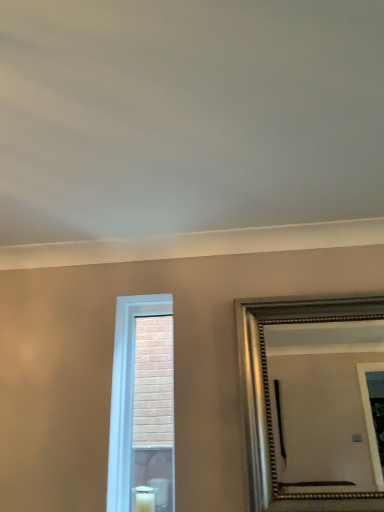
The width and height of the screenshot is (384, 512). Find the location of `white glass window at center`. white glass window at center is located at coordinates (142, 403).

In the scene shown: Can silver metallic mirror at right be found inside white glass window at center?

No.

Is point (164, 506) behind point (295, 327)?

Yes, point (164, 506) is behind point (295, 327).

From the image's perspective, is white glass window at center under silver metallic mirror at right?

Yes, from the image's perspective, white glass window at center is beneath silver metallic mirror at right.

Which object is positioned more to the right, white glass window at center or silver metallic mirror at right?

silver metallic mirror at right.

Where is `candle that is on the right side of white glass window at center`? This screenshot has height=512, width=384. candle that is on the right side of white glass window at center is located at coordinates [x=144, y=499].

Can you confirm if white glass window at center is thinner than white wax candle at lower center?

Indeed, white glass window at center has a lesser width compared to white wax candle at lower center.

Does white glass window at center have a smaller size compared to white wax candle at lower center?

No.

Is white glass window at center far away from white wax candle at lower center?

No, there isn't a large distance between white glass window at center and white wax candle at lower center.

Is silver metallic mirror at right far from white wax candle at lower center?

Yes, silver metallic mirror at right is far from white wax candle at lower center.

How distant is silver metallic mirror at right from white wax candle at lower center?

silver metallic mirror at right and white wax candle at lower center are 1.70 meters apart.

Which of these two, silver metallic mirror at right or white wax candle at lower center, stands shorter?

white wax candle at lower center is shorter.

Is silver metallic mirror at right completely or partially outside of white wax candle at lower center?

Yes, silver metallic mirror at right is outside of white wax candle at lower center.

Is silver metallic mirror at right at the back of white wax candle at lower center?

white wax candle at lower center does not have its back to silver metallic mirror at right.

Between white wax candle at lower center and silver metallic mirror at right, which one has larger size?

With larger size is silver metallic mirror at right.

Find the location of a particular element. mirror positioned vertically above the white wax candle at lower center (from a real-world perspective) is located at coordinates (x=325, y=405).

Would you say white wax candle at lower center is to the left or to the right of silver metallic mirror at right in the picture?

white wax candle at lower center is to the left of silver metallic mirror at right.

Can you confirm if white wax candle at lower center is bigger than white glass window at center?

Actually, white wax candle at lower center might be smaller than white glass window at center.

From the image's perspective, which is below, white wax candle at lower center or white glass window at center?

From the image's view, white wax candle at lower center is below.

From a real-world perspective, relative to white glass window at center, is white wax candle at lower center vertically above or below?

white wax candle at lower center is situated lower than white glass window at center in the real world.

Is white wax candle at lower center facing towards white glass window at center?

No, white wax candle at lower center is not oriented towards white glass window at center.

Based on the photo, is silver metallic mirror at right behind white glass window at center?

No, it is not.

The width and height of the screenshot is (384, 512). Find the location of `mirror beneath the white glass window at center (from a real-world perspective)`. mirror beneath the white glass window at center (from a real-world perspective) is located at coordinates (325, 405).

Is point (285, 459) closer to camera compared to point (165, 463)?

Yes, it is.

You are a GUI agent. You are given a task and a screenshot of the screen. Output one action in this format:
    pyautogui.click(x=<x>, y=<y>)
    Task: Click on the window that is below the silver metallic mirror at right (from the image's perspective)
    
    Given the screenshot: What is the action you would take?
    pyautogui.click(x=142, y=403)

Where is `candle to the right of white glass window at center`? This screenshot has width=384, height=512. candle to the right of white glass window at center is located at coordinates (144, 499).

Looking at the image, which one is located further to white wax candle at lower center, silver metallic mirror at right or white glass window at center?

Based on the image, silver metallic mirror at right appears to be further to white wax candle at lower center.

Estimate the real-world distances between objects in this image. Which object is further from silver metallic mirror at right, white wax candle at lower center or white glass window at center?

Based on the image, white wax candle at lower center appears to be further to silver metallic mirror at right.

Estimate the real-world distances between objects in this image. Which object is closer to white wax candle at lower center, white glass window at center or silver metallic mirror at right?

white glass window at center is positioned closer to the anchor white wax candle at lower center.

Considering their positions, is white wax candle at lower center positioned closer to white glass window at center than silver metallic mirror at right?

white wax candle at lower center lies closer to white glass window at center than the other object.

Considering their positions, is white glass window at center positioned closer to silver metallic mirror at right than white wax candle at lower center?

white glass window at center.

From the image, which object appears to be nearer to white glass window at center, silver metallic mirror at right or white wax candle at lower center?

Based on the image, white wax candle at lower center appears to be nearer to white glass window at center.

You are a GUI agent. You are given a task and a screenshot of the screen. Output one action in this format:
    pyautogui.click(x=<x>, y=<y>)
    Task: Click on the candle situated between white glass window at center and silver metallic mirror at right from left to right
    Image resolution: width=384 pixels, height=512 pixels.
    Given the screenshot: What is the action you would take?
    pyautogui.click(x=144, y=499)